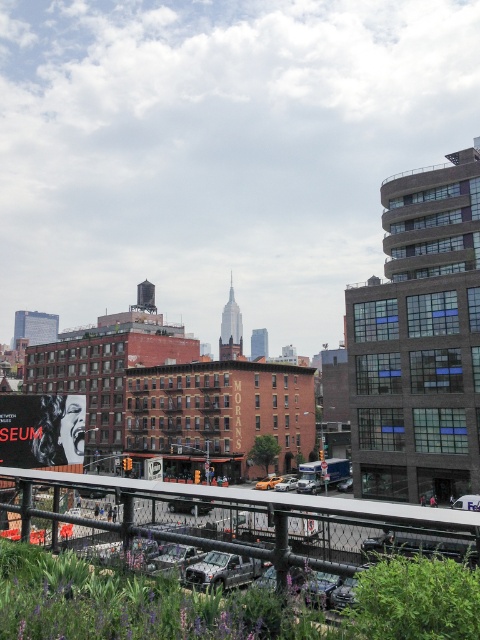
You are a delivery person trying to navigate through the city. You see the black metal railing at lower center and the matte black poster at lower left. Which object is bigger?

The black metal railing at lower center is larger in size compared to the matte black poster at lower left.

You are standing on an elevated walkway overlooking a city. You see a black metal railing at lower center and a matte black poster at lower left. Which object is closer to your left side?

The matte black poster at lower left is closer to your left side since it is positioned to the left of the black metal railing at lower center.

Consider the image. You are standing at the edge of an elevated walkway overlooking a city. You notice the black metal railing at lower center and want to take a photo of the red brick building with

The black metal railing at lower center is located at coordinates point (x=260, y=518), so you can position yourself to avoid it and capture the red brick building with